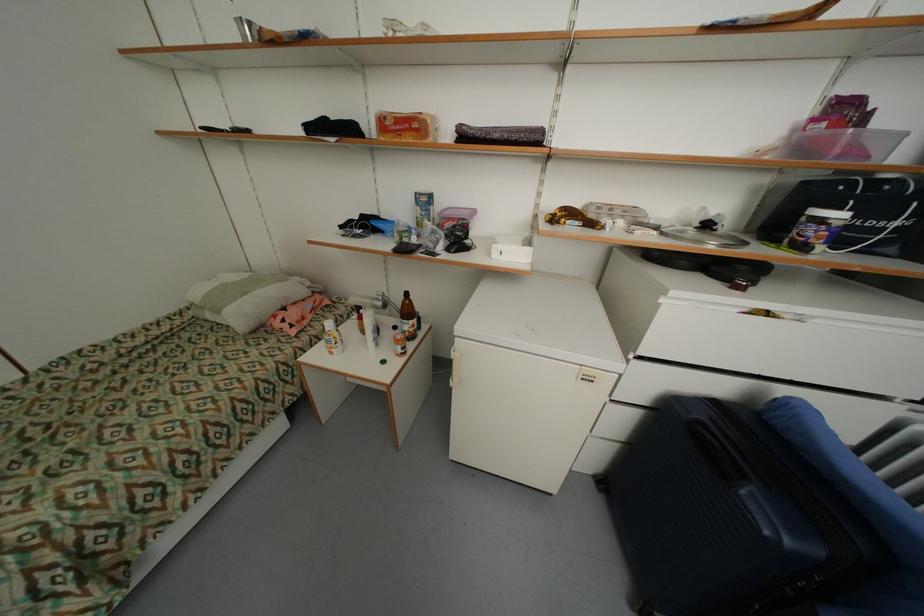
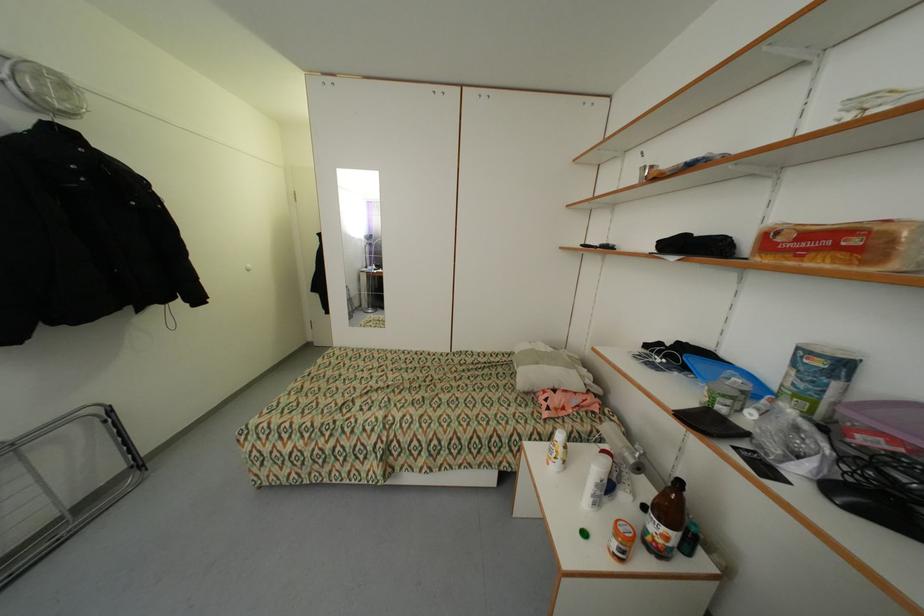
Locate, in the second image, the point that corresponds to the point at 386,304 in the first image.

(638, 462)